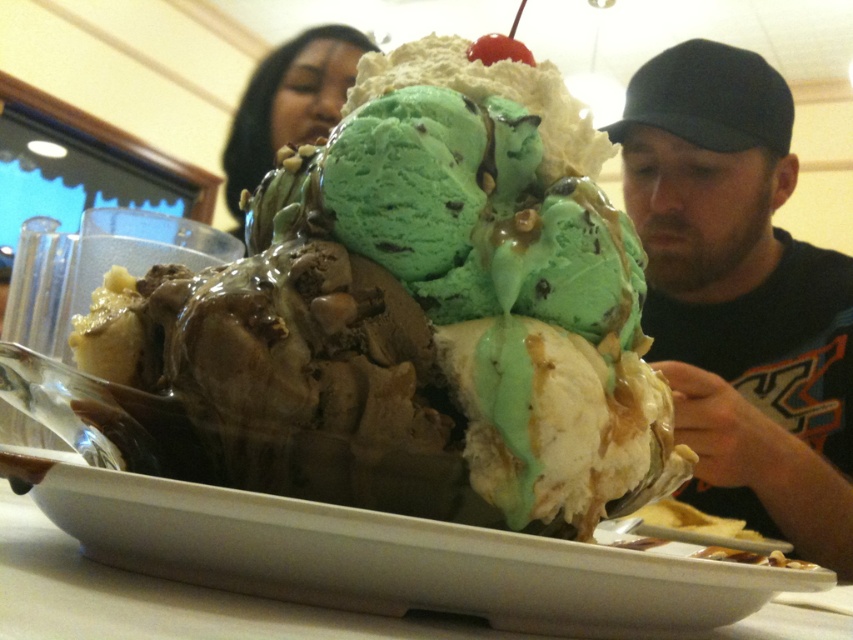
You are a food photographer trying to capture the perfect angle of the chocolate ice cream at center and the dark blue cap at right. If you want to ensure both are in frame, how far apart are they from each other?

The chocolate ice cream at center is 28.13 inches from the dark blue cap at right, so they are 28.13 inches apart.

You are sitting at a table with the large ice cream sundae in front of you. You notice the chocolate ice cream at center and the black hair at upper center. Which object is nearer to you?

The chocolate ice cream at center is closer to the viewer than the black hair at upper center.